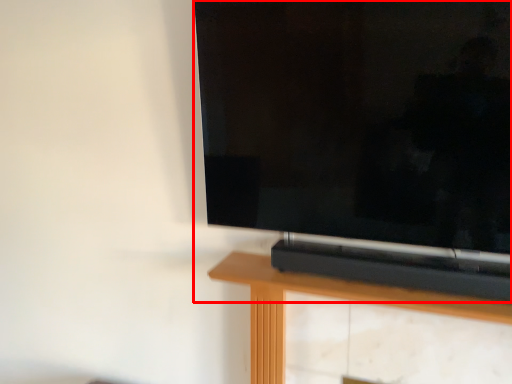
Question: From the image's perspective, what is the correct spatial positioning of television (annotated by the red box) in reference to furniture?

Choices:
 (A) below
 (B) above

Answer: (B)